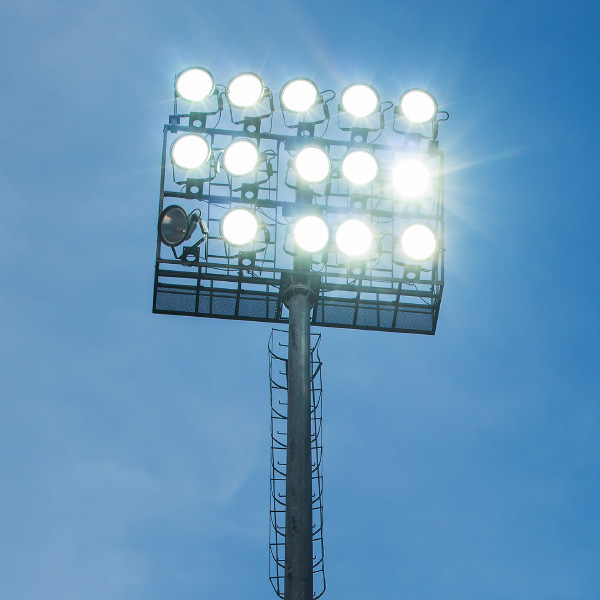
Identify the location of lights on top line. (200, 81), (251, 98), (304, 96), (362, 111), (422, 111).